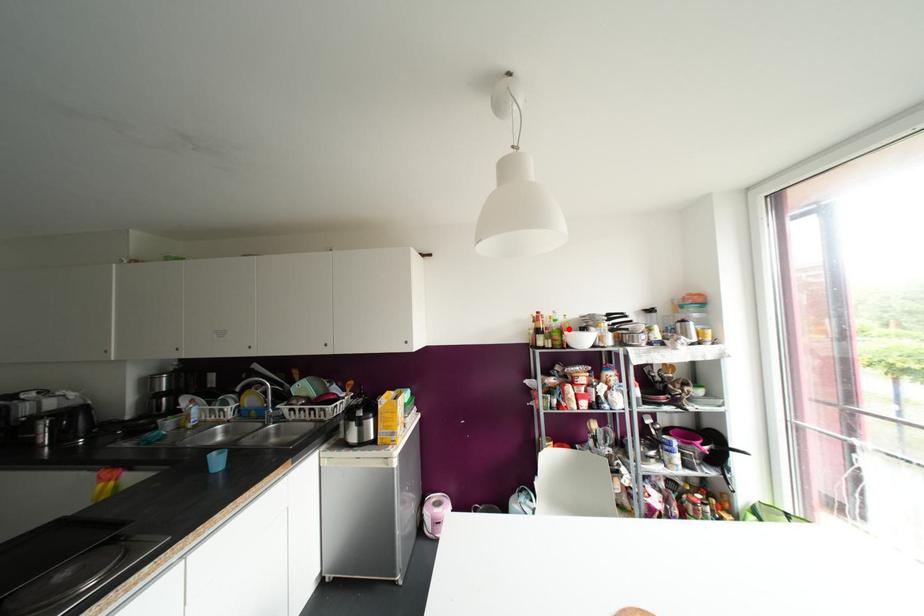
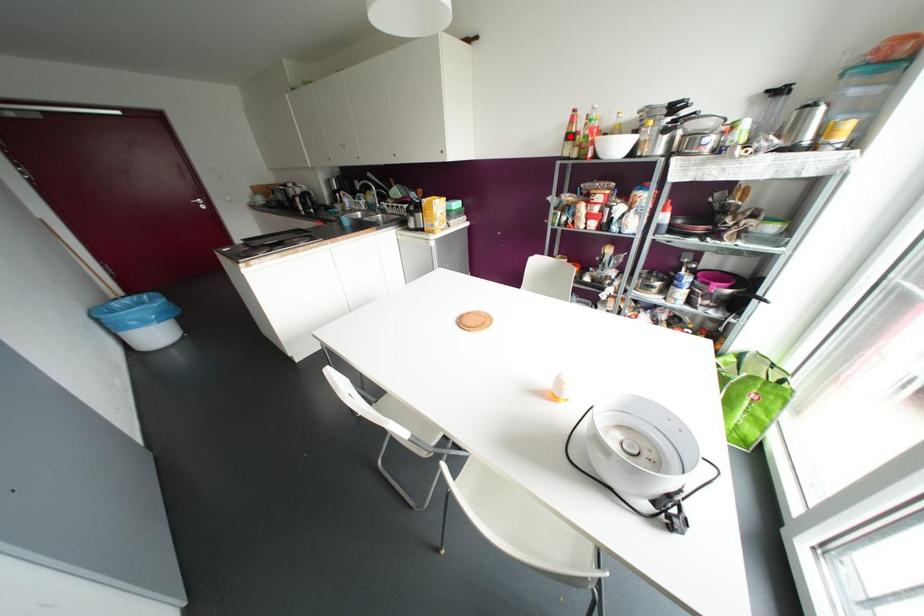
I am providing you with two images of the same scene from different viewpoints. A red point is marked on the first image and another point is marked on the second image. Is the red point in image1 aligned with the point shown in image2?

No